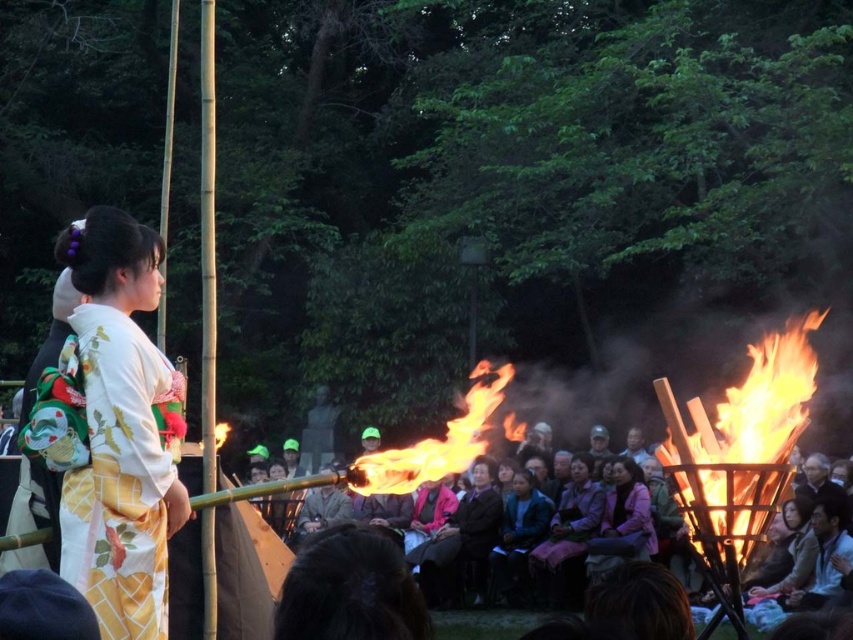
Does pink fabric kimono at center have a lesser width compared to blue fabric jacket at center?

Incorrect, pink fabric kimono at center's width is not less than blue fabric jacket at center's.

Is pink fabric kimono at center further to the viewer compared to blue fabric jacket at center?

No, it is in front of blue fabric jacket at center.

This screenshot has height=640, width=853. I want to click on pink fabric kimono at center, so click(x=567, y=538).

What do you see at coordinates (119, 432) in the screenshot?
I see `white silk kimono at left` at bounding box center [119, 432].

Who is lower down, white silk kimono at left or dark brown leather jacket at center?

dark brown leather jacket at center is lower down.

Does point (90, 253) come farther from viewer compared to point (445, 570)?

No, it is in front of (445, 570).

Find the location of a particular element. This screenshot has width=853, height=640. white silk kimono at left is located at coordinates (119, 432).

Between flamematerial/texture at center and blue fabric jacket at center, which one is positioned higher?

flamematerial/texture at center is higher up.

Can you confirm if flamematerial/texture at center is bigger than blue fabric jacket at center?

Yes.

At what (x,y) coordinates should I click in order to perform the action: click on flamematerial/texture at center. Please return your answer as a coordinate pair (x, y). Looking at the image, I should click on (436, 442).